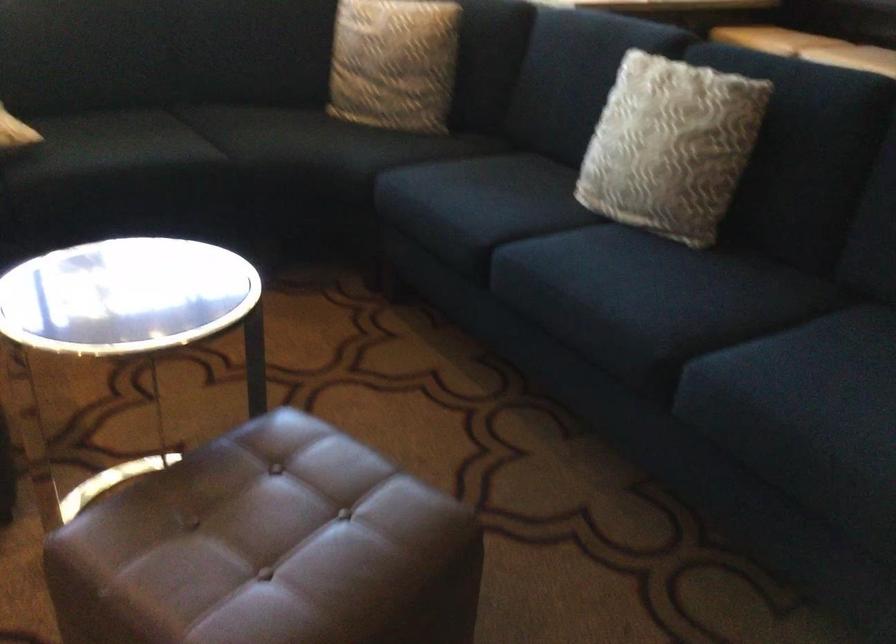
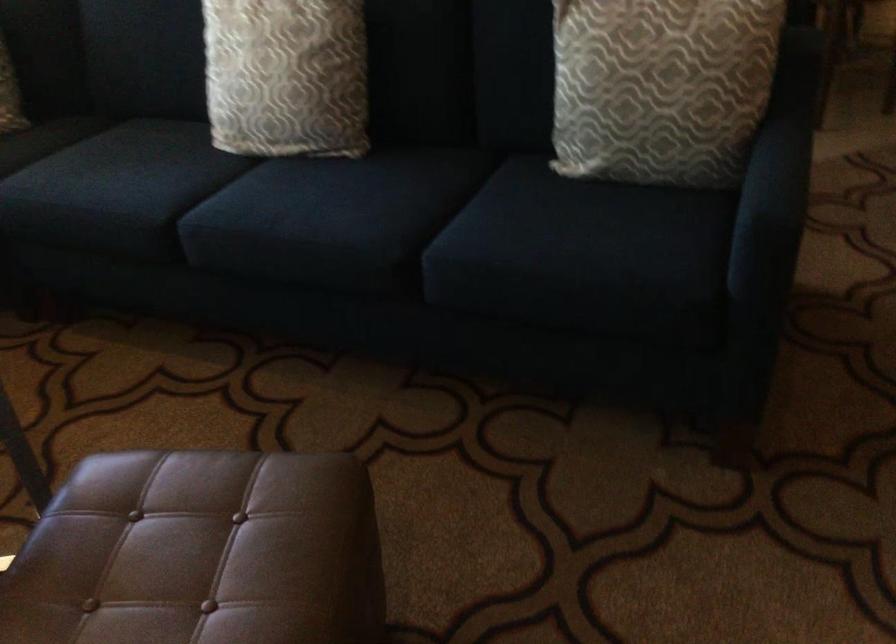
Question: The camera is either moving clockwise (left) or counter-clockwise (right) around the object. The first image is from the beginning of the video and the second image is from the end. Is the camera moving left or right when shooting the video?

Choices:
 (A) Left
 (B) Right

Answer: (A)